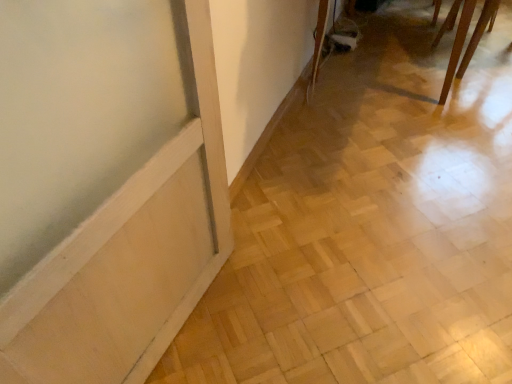
Question: Is light wood parquet floor at lower left inside or outside of wooden dining table at upper right?

Choices:
 (A) inside
 (B) outside

Answer: (B)

Question: Based on their sizes in the image, would you say light wood parquet floor at lower left is bigger or smaller than wooden dining table at upper right?

Choices:
 (A) small
 (B) big

Answer: (A)

Question: Relative to wooden dining table at upper right, is light wood parquet floor at lower left in front or behind?

Choices:
 (A) behind
 (B) front

Answer: (B)

Question: From their relative heights in the image, would you say wooden dining table at upper right is taller or shorter than light wood parquet floor at lower left?

Choices:
 (A) tall
 (B) short

Answer: (A)

Question: Relative to light wood parquet floor at lower left, is wooden dining table at upper right in front or behind?

Choices:
 (A) front
 (B) behind

Answer: (B)

Question: Looking at their shapes, would you say wooden dining table at upper right is wider or thinner than light wood parquet floor at lower left?

Choices:
 (A) thin
 (B) wide

Answer: (A)

Question: Which is correct: wooden dining table at upper right is inside light wood parquet floor at lower left, or outside of it?

Choices:
 (A) outside
 (B) inside

Answer: (A)